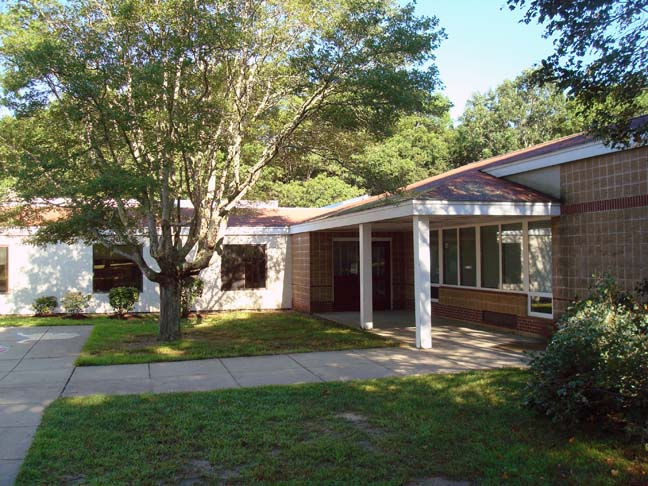
Where is `window`? window is located at coordinates (237, 266), (118, 262), (2, 264), (433, 249), (452, 254), (467, 256), (491, 255), (513, 254), (542, 257).